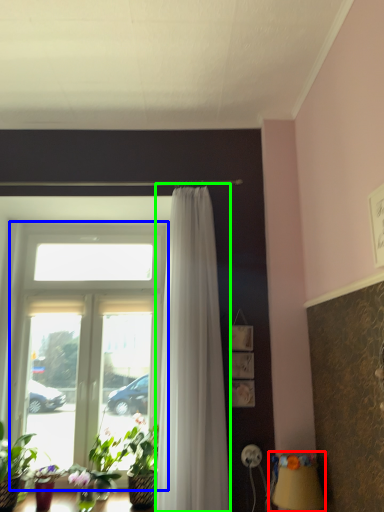
Question: Which object is positioned closest to table lamp (highlighted by a red box)? Select from window (highlighted by a blue box) and curtain (highlighted by a green box).

Choices:
 (A) window
 (B) curtain

Answer: (B)